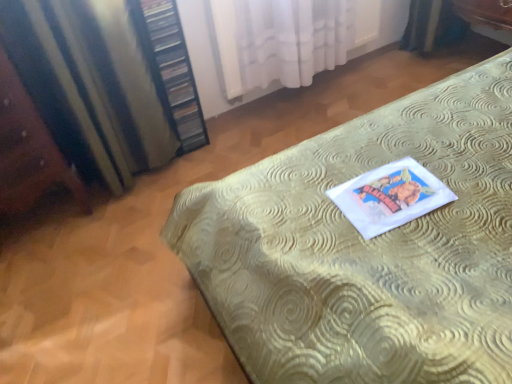
Question: Is gold textured bed at center taller than satin striped curtain at left, which is the 1th curtain in left-to-right order?

Choices:
 (A) yes
 (B) no

Answer: (A)

Question: Can you see gold textured bed at center touching satin striped curtain at left, positioned as the second curtain in right-to-left order?

Choices:
 (A) no
 (B) yes

Answer: (A)

Question: From a real-world perspective, is gold textured bed at center under satin striped curtain at left, which is the 1th curtain in left-to-right order?

Choices:
 (A) no
 (B) yes

Answer: (A)

Question: Is gold textured bed at center to the right of satin striped curtain at left, which is the 1th curtain in left-to-right order, from the viewer's perspective?

Choices:
 (A) yes
 (B) no

Answer: (A)

Question: From the image's perspective, is gold textured bed at center over satin striped curtain at left, which is the 1th curtain in left-to-right order?

Choices:
 (A) yes
 (B) no

Answer: (B)

Question: Is gold textured bed at center to the left of satin striped curtain at left, which is the 1th curtain in left-to-right order, from the viewer's perspective?

Choices:
 (A) yes
 (B) no

Answer: (B)

Question: Does satin striped curtain at left, which is the 1th curtain in left-to-right order, have a smaller size compared to gold textured bed at center?

Choices:
 (A) yes
 (B) no

Answer: (A)

Question: Does satin striped curtain at left, positioned as the second curtain in right-to-left order, have a lesser width compared to gold textured bed at center?

Choices:
 (A) no
 (B) yes

Answer: (B)

Question: Considering the relative sizes of satin striped curtain at left, which is the 1th curtain in left-to-right order, and gold textured bed at center in the image provided, is satin striped curtain at left, which is the 1th curtain in left-to-right order, shorter than gold textured bed at center?

Choices:
 (A) no
 (B) yes

Answer: (B)

Question: From the image's perspective, does satin striped curtain at left, positioned as the second curtain in right-to-left order, appear higher than gold textured bed at center?

Choices:
 (A) no
 (B) yes

Answer: (B)

Question: Is satin striped curtain at left, which is the 1th curtain in left-to-right order, positioned behind gold textured bed at center?

Choices:
 (A) no
 (B) yes

Answer: (B)

Question: Is satin striped curtain at left, positioned as the second curtain in right-to-left order, looking in the opposite direction of gold textured bed at center?

Choices:
 (A) yes
 (B) no

Answer: (B)

Question: From a real-world perspective, is wooden bookshelf at left located higher than white sheer curtain at upper center, which is the second curtain from left to right?

Choices:
 (A) yes
 (B) no

Answer: (A)